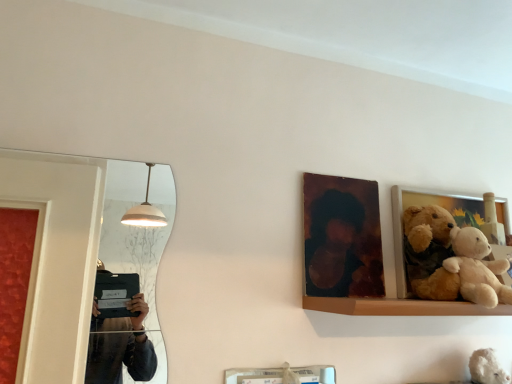
Question: Is the depth of wooden picture frame at right, the 2th picture frame from the left, less than that of white plush teddy bear at lower right?

Choices:
 (A) no
 (B) yes

Answer: (A)

Question: Is wooden picture frame at right, marked as the first picture frame in a right-to-left arrangement, next to white plush teddy bear at lower right?

Choices:
 (A) yes
 (B) no

Answer: (B)

Question: Is wooden picture frame at right, the 2th picture frame from the left, surrounding white plush teddy bear at lower right?

Choices:
 (A) no
 (B) yes

Answer: (A)

Question: From the image's perspective, is wooden picture frame at right, the 2th picture frame from the left, located above white plush teddy bear at lower right?

Choices:
 (A) yes
 (B) no

Answer: (A)

Question: Does wooden picture frame at right, marked as the first picture frame in a right-to-left arrangement, have a larger size compared to white plush teddy bear at lower right?

Choices:
 (A) yes
 (B) no

Answer: (A)

Question: Is soft plush teddy bear at right to the left or to the right of wooden picture frame at right, marked as the first picture frame in a right-to-left arrangement, in the image?

Choices:
 (A) right
 (B) left

Answer: (B)

Question: From the image's perspective, is soft plush teddy bear at right above or below wooden picture frame at right, marked as the first picture frame in a right-to-left arrangement?

Choices:
 (A) above
 (B) below

Answer: (B)

Question: In terms of width, does soft plush teddy bear at right look wider or thinner when compared to wooden picture frame at right, marked as the first picture frame in a right-to-left arrangement?

Choices:
 (A) thin
 (B) wide

Answer: (B)

Question: From their relative heights in the image, would you say soft plush teddy bear at right is taller or shorter than wooden picture frame at right, the 2th picture frame from the left?

Choices:
 (A) short
 (B) tall

Answer: (A)

Question: In terms of size, does soft plush teddy bear at right appear bigger or smaller than wooden photo frame at upper center, the first picture frame positioned from the left?

Choices:
 (A) small
 (B) big

Answer: (B)

Question: From a real-world perspective, is soft plush teddy bear at right physically located above or below wooden photo frame at upper center, the first picture frame positioned from the left?

Choices:
 (A) below
 (B) above

Answer: (A)

Question: Looking at their shapes, would you say soft plush teddy bear at right is wider or thinner than wooden photo frame at upper center, the first picture frame positioned from the left?

Choices:
 (A) thin
 (B) wide

Answer: (B)

Question: In terms of height, does soft plush teddy bear at right look taller or shorter compared to wooden photo frame at upper center, the first picture frame positioned from the left?

Choices:
 (A) short
 (B) tall

Answer: (A)

Question: Is soft plush teddy bear at right in front of or behind white plush teddy bear at lower right in the image?

Choices:
 (A) behind
 (B) front

Answer: (B)

Question: Considering the relative positions of soft plush teddy bear at right and white plush teddy bear at lower right in the image provided, is soft plush teddy bear at right to the left or to the right of white plush teddy bear at lower right?

Choices:
 (A) left
 (B) right

Answer: (A)